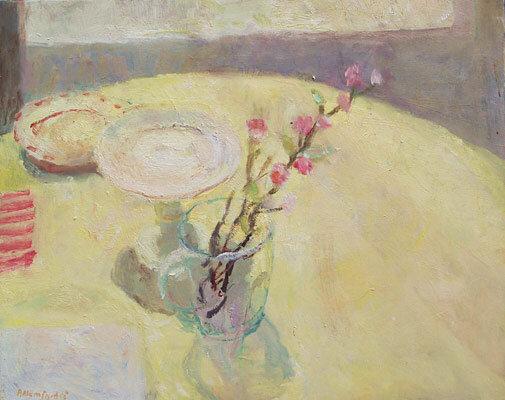
The width and height of the screenshot is (505, 400). I want to click on cup, so click(234, 282).